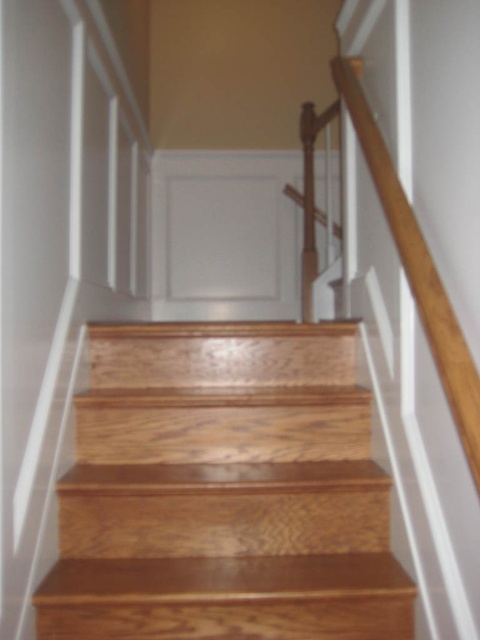
Question: Among these points, which one is nearest to the camera?

Choices:
 (A) (440, 300)
 (B) (80, 451)

Answer: (A)

Question: Is wooden stairs at center thinner than wooden handrail at upper right?

Choices:
 (A) yes
 (B) no

Answer: (B)

Question: Which object is closer to the camera taking this photo?

Choices:
 (A) wooden handrail at upper right
 (B) wooden stairs at center

Answer: (A)

Question: Does wooden stairs at center have a lesser width compared to wooden handrail at upper right?

Choices:
 (A) yes
 (B) no

Answer: (B)

Question: Is wooden stairs at center positioned in front of wooden handrail at upper right?

Choices:
 (A) no
 (B) yes

Answer: (A)